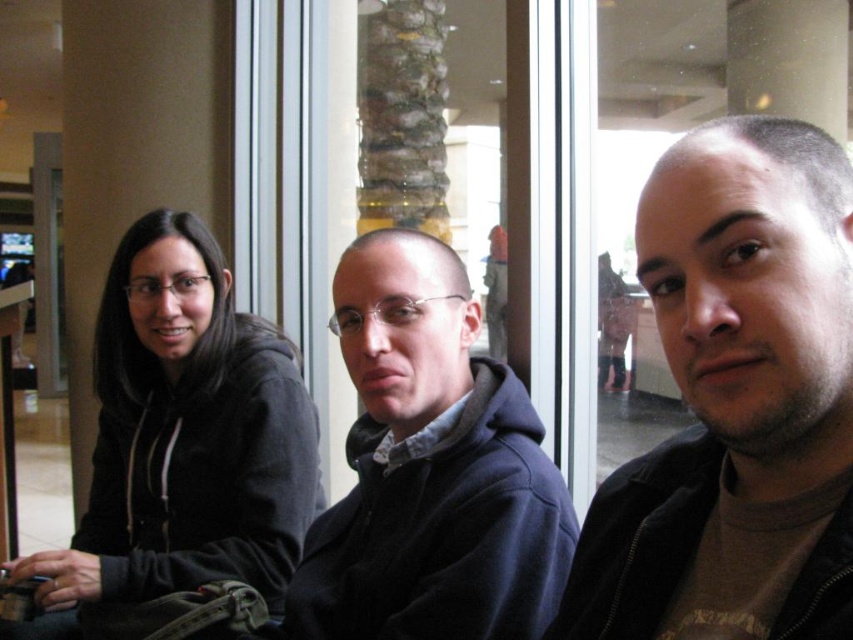
You are trying to decide which clothing item to take for a windy day. You have the dark brown leather jacket at center and the dark blue hoodie at center. Which one would be more suitable based on their thickness?

The dark brown leather jacket at center is thinner than the dark blue hoodie at center, so the dark blue hoodie at center would be more suitable for a windy day due to its thicker material providing better wind resistance.